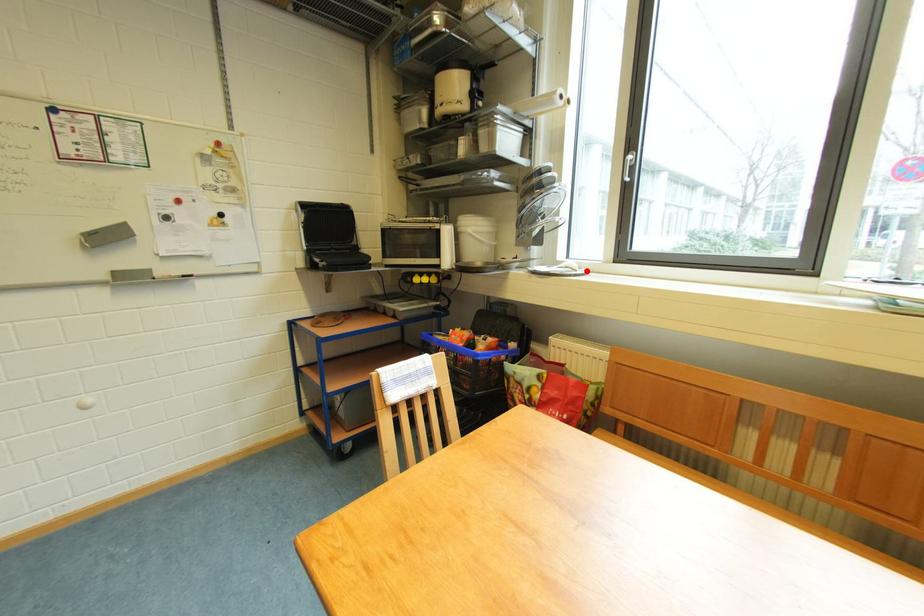
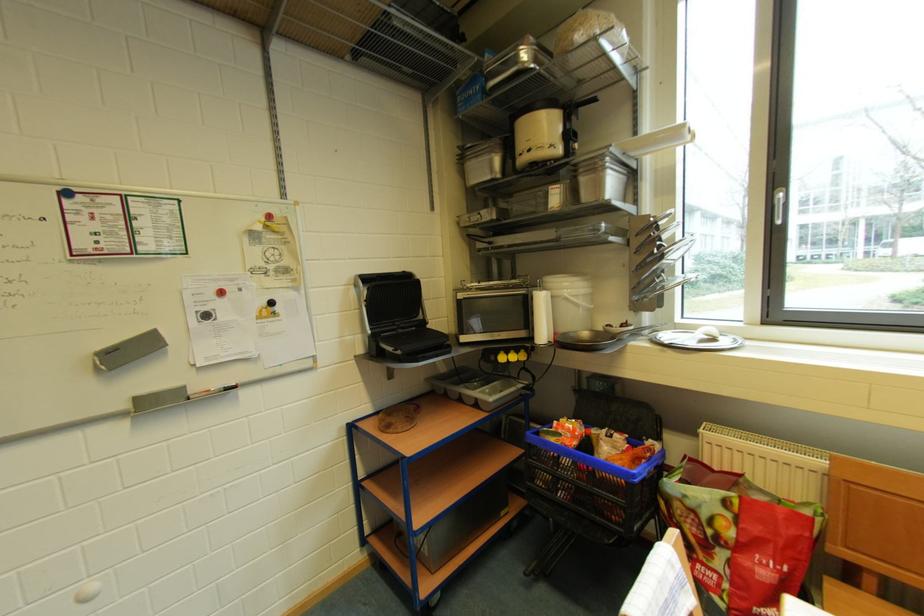
The point at the highlighted location is marked in the first image. Where is the corresponding point in the second image?

(730, 339)